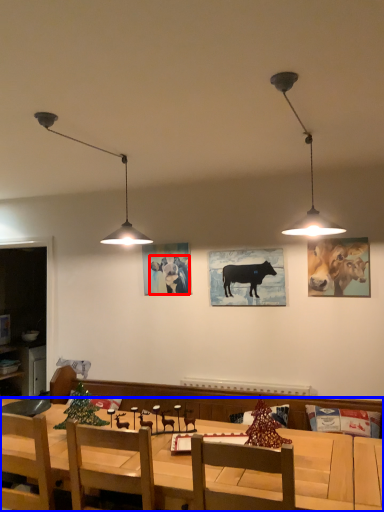
Question: Which of the following is the closest to the observer, cattle (highlighted by a red box) or desk (highlighted by a blue box)?

Choices:
 (A) cattle
 (B) desk

Answer: (B)